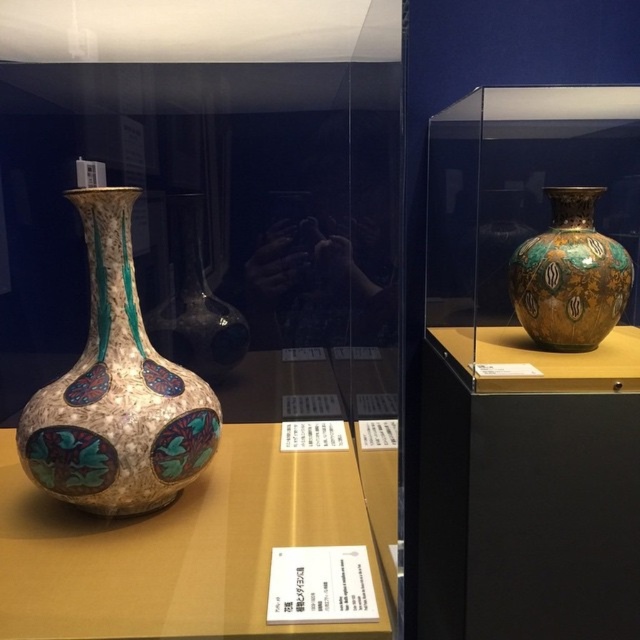
You are a museum curator planning to install a new lighting fixture above the two vases. The fixture must be positioned so that it can illuminate both vases equally. Given that the matte glass vase at left is much taller than the gold and turquoise mosaic vase at right, where should you place the lighting fixture to ensure both vases receive adequate light?

The lighting fixture should be placed above the center point between the matte glass vase at left and the gold and turquoise mosaic vase at right. Since the matte glass vase at left is much taller, positioning the light centrally will ensure both vases receive balanced illumination without overshadowing either.

You are a museum visitor standing in front of the display case. You notice the enamel vase at left and want to know its exact position relative to the center of the display. Can you determine if it is positioned to the left or right of the center?

The enamel vase at left is located at point (116, 392), which means it is positioned to the left of the center of the display.

You are a museum curator planning to move the gold and turquoise mosaic vase at right to a new display case. You need to know if the enamel vase at left can fit in its place. Can it fit?

The enamel vase at left is larger in size than the gold and turquoise mosaic vase at right, so it may not fit in the space originally intended for the smaller vase.